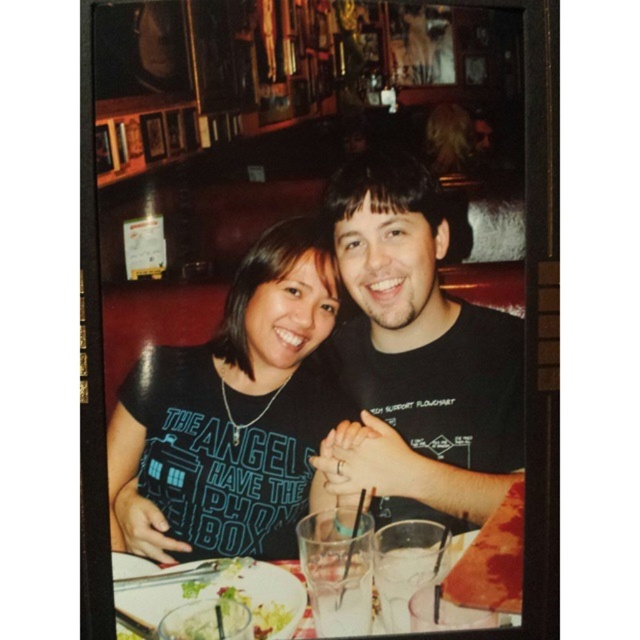
Question: Does black matte shirt at center have a lesser width compared to black matte t-shirt at center?

Choices:
 (A) no
 (B) yes

Answer: (A)

Question: Among these points, which one is nearest to the camera?

Choices:
 (A) (380, 497)
 (B) (173, 566)
 (C) (209, 436)

Answer: (B)

Question: Is black matte t-shirt at center above clear glassware at center?

Choices:
 (A) no
 (B) yes

Answer: (B)

Question: Is black matte shirt at center bigger than black matte t-shirt at center?

Choices:
 (A) yes
 (B) no

Answer: (A)

Question: Which object is farther from the camera taking this photo?

Choices:
 (A) clear glassware at center
 (B) black matte shirt at center
 (C) black matte t-shirt at center

Answer: (C)

Question: Which point is farther from the camera taking this photo?

Choices:
 (A) (145, 602)
 (B) (440, 497)
 (C) (148, 458)

Answer: (B)